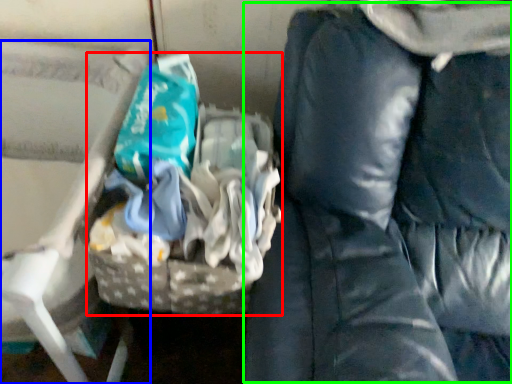
Question: Which object is positioned farthest from waste (highlighted by a red box)? Select from furniture (highlighted by a blue box) and bean bag chair (highlighted by a green box).

Choices:
 (A) furniture
 (B) bean bag chair

Answer: (A)